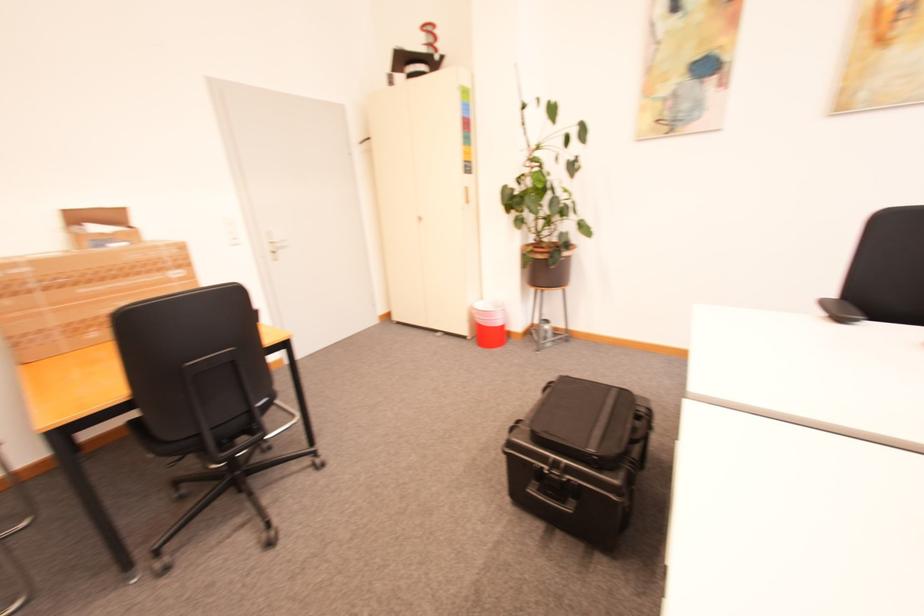
Find where to resting arm the black chair armrest. Please return your answer as a coordinate pair (x, y).

(201, 392)